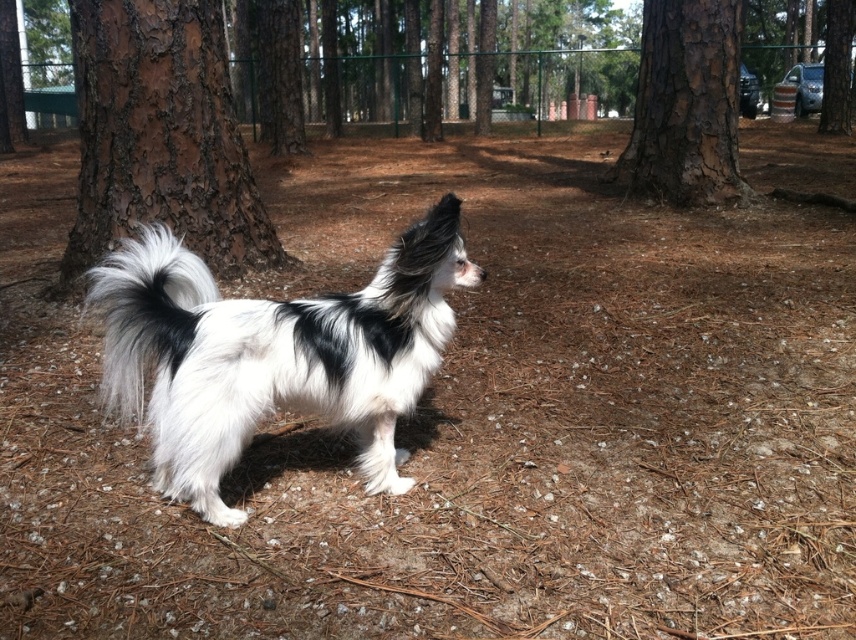
Question: Is white fluffy dog at center thinner than white fluffy tail at center?

Choices:
 (A) no
 (B) yes

Answer: (A)

Question: Is white fluffy dog at center smaller than brown rough bark at left?

Choices:
 (A) no
 (B) yes

Answer: (B)

Question: Among these points, which one is nearest to the camera?

Choices:
 (A) (360, 362)
 (B) (705, 129)
 (C) (129, 240)

Answer: (A)

Question: Is the position of brown rough bark tree at center less distant than that of white fluffy tail at center?

Choices:
 (A) no
 (B) yes

Answer: (A)

Question: Estimate the real-world distances between objects in this image. Which object is farther from the white fluffy dog at center?

Choices:
 (A) white fluffy tail at center
 (B) brown rough bark tree at center
 (C) brown rough bark at left

Answer: (B)

Question: Among these points, which one is farthest from the camera?

Choices:
 (A) (247, 268)
 (B) (663, 88)
 (C) (158, 380)
 (D) (167, 372)

Answer: (B)